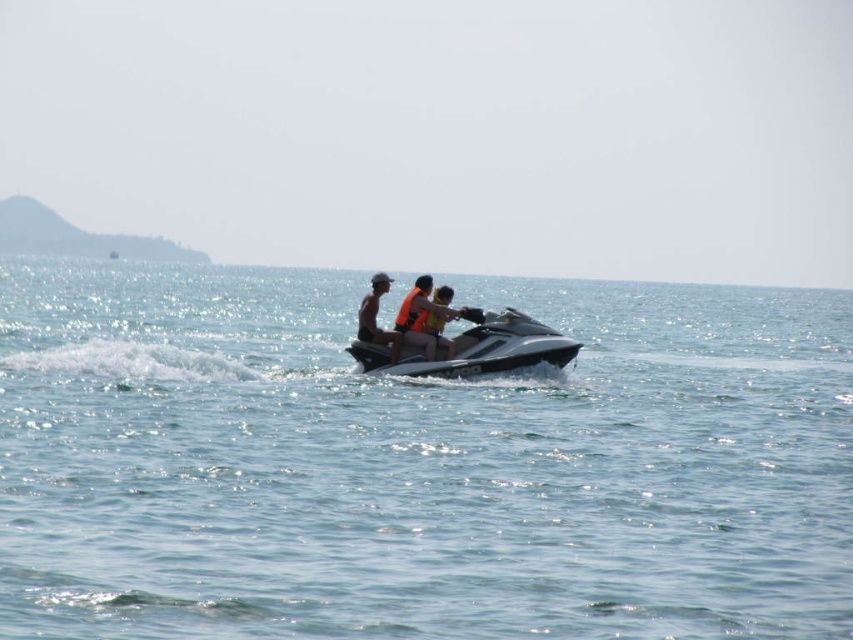
Does tan skin person at center appear under orange life vest at center?

No, tan skin person at center is not below orange life vest at center.

Can you confirm if tan skin person at center is thinner than orange life vest at center?

Incorrect, tan skin person at center's width is not less than orange life vest at center's.

Which is in front, point (379, 289) or point (445, 342)?

Positioned in front is point (445, 342).

Locate an element on the screen. Image resolution: width=853 pixels, height=640 pixels. tan skin person at center is located at coordinates (375, 317).

Is matte orange life vest at center taller than tan skin person at center?

Incorrect, matte orange life vest at center's height is not larger of tan skin person at center's.

Locate an element on the screen. The image size is (853, 640). matte orange life vest at center is located at coordinates (409, 317).

Is point (364, 333) behind point (370, 337)?

Yes, it is.

At what (x,y) coordinates should I click in order to perform the action: click on matte orange life vest at center. Please return your answer as a coordinate pair (x, y). Looking at the image, I should click on (409, 317).

Is silver metallic jet ski at center further to camera compared to orange life vest at center?

No.

Does silver metallic jet ski at center have a lesser width compared to orange life vest at center?

No, silver metallic jet ski at center is not thinner than orange life vest at center.

Which is in front, point (459, 353) or point (439, 337)?

Point (459, 353) is more forward.

You are a GUI agent. You are given a task and a screenshot of the screen. Output one action in this format:
    pyautogui.click(x=<x>, y=<y>)
    Task: Click on the silver metallic jet ski at center
    
    Given the screenshot: What is the action you would take?
    pyautogui.click(x=474, y=348)